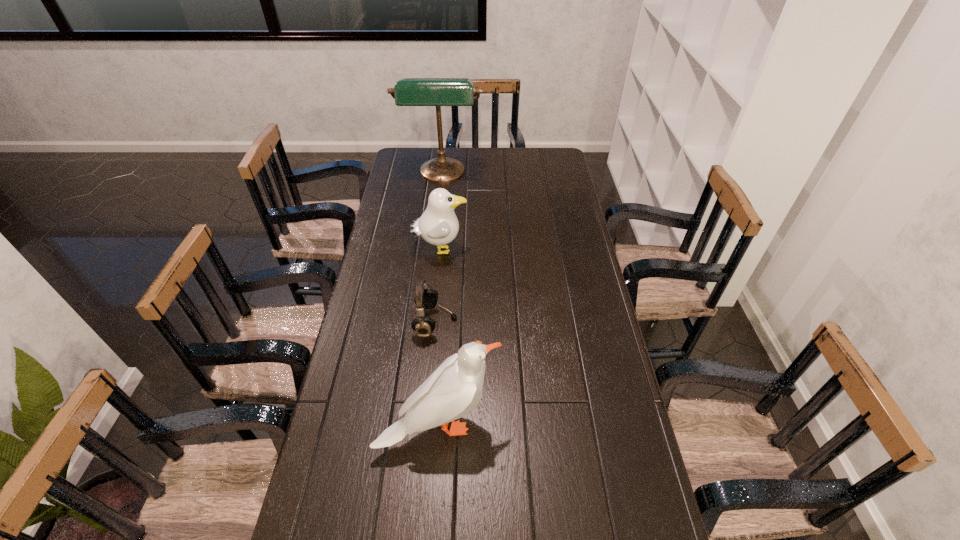
Locate an element on the screen. This screenshot has width=960, height=540. the farthest object is located at coordinates (437, 92).

You are a GUI agent. You are given a task and a screenshot of the screen. Output one action in this format:
    pyautogui.click(x=<x>, y=<y>)
    Task: Click on the tallest object
    
    Given the screenshot: What is the action you would take?
    pyautogui.click(x=437, y=92)

Locate an element on the screen. Image resolution: width=960 pixels, height=540 pixels. the nearest object is located at coordinates (455, 388).

You are a GUI agent. You are given a task and a screenshot of the screen. Output one action in this format:
    pyautogui.click(x=<x>, y=<y>)
    Task: Click on the third nearest object
    
    Given the screenshot: What is the action you would take?
    pyautogui.click(x=438, y=225)

Identify the location of the second nearest object. (425, 298).

Identify the location of the shortest object. The height and width of the screenshot is (540, 960). pyautogui.click(x=425, y=298).

Where is `free space located 0.270m above the green lampshade of the tallest object`? This screenshot has width=960, height=540. free space located 0.270m above the green lampshade of the tallest object is located at coordinates (436, 229).

I want to click on free region located at the beak of the nearest object, so click(x=529, y=426).

Locate an element on the screen. Image resolution: width=960 pixels, height=540 pixels. vacant position located 0.370m on the beak of the second farthest object is located at coordinates (564, 250).

Identify the location of vacant space located 0.310m with the microphone on the side of the headset. (551, 322).